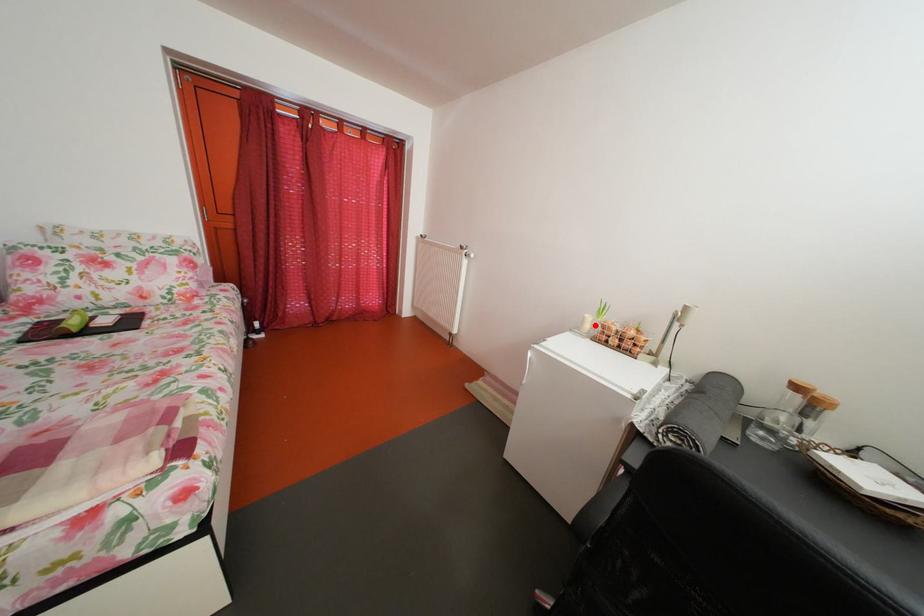
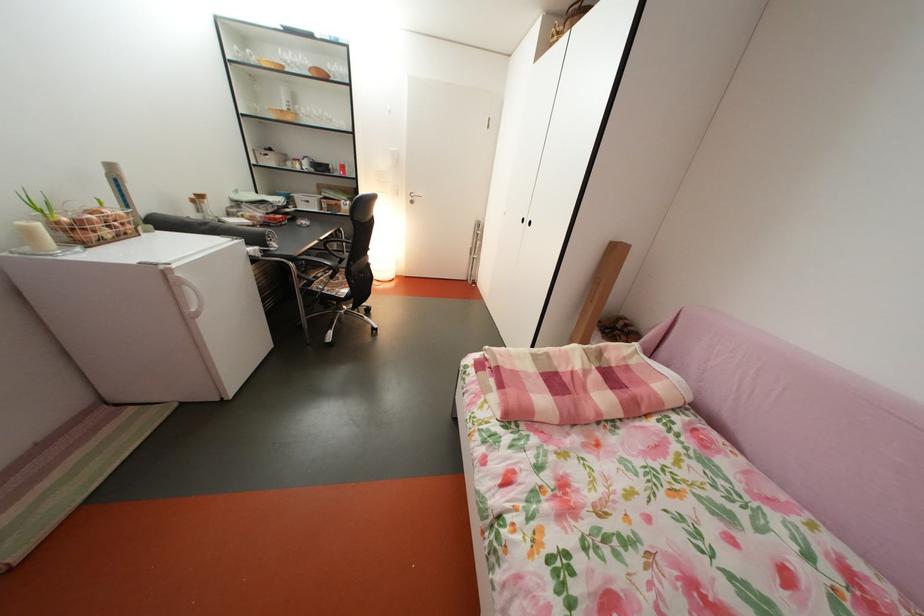
Locate, in the second image, the point that corresponds to the highlighted location in the first image.

(41, 238)